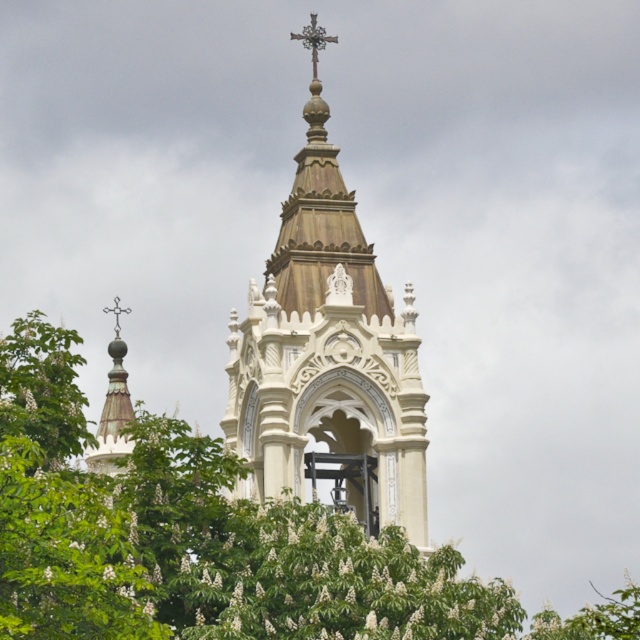
Which is in front, point (60, 588) or point (310, 38)?

Point (60, 588) is more forward.

Is green leafy tree at center above polished bronze cross at upper center?

Actually, green leafy tree at center is below polished bronze cross at upper center.

Does point (285, 508) come in front of point (314, 29)?

That is True.

Find the location of a particular element. The image size is (640, 640). green leafy tree at center is located at coordinates (192, 536).

Measure the distance from polished bronze cross at upper center to silver metallic cross at upper left.

The distance of polished bronze cross at upper center from silver metallic cross at upper left is 29.62 meters.

Who is positioned more to the left, polished bronze cross at upper center or silver metallic cross at upper left?

silver metallic cross at upper left is more to the left.

Between point (305, 44) and point (116, 310), which one is positioned behind?

Point (116, 310)

Find the location of a particular element. This screenshot has width=640, height=640. polished bronze cross at upper center is located at coordinates (314, 38).

Between green leafy tree at center and white carved stone bell tower at center, which one is positioned higher?

white carved stone bell tower at center

Is the position of green leafy tree at center less distant than that of white carved stone bell tower at center?

Yes, it is in front of white carved stone bell tower at center.

Image resolution: width=640 pixels, height=640 pixels. I want to click on green leafy tree at center, so click(192, 536).